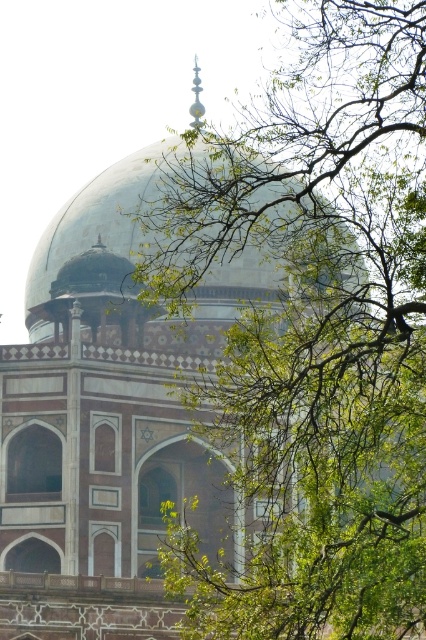
You are an architect designing a new garden around the green glass dome at center. You want to ensure that the green leafy branches at upper center do not block the view of the dome from the garden path. Based on the current sizes of these elements, is this feasible?

The green leafy branches at upper center are bigger than the green glass dome at center. This means they could potentially block the dome from view if not managed. To ensure visibility, the branches would need to be pruned or positioned so their size doesn

You are standing in front of a historic Mughal building with a large dome. You notice a point marked at coordinates (314, 330). Based on the scene, what is the location of this point relative to the building and its surroundings?

The point at (314, 330) is located on green leafy branches at the upper center, which partially obscure the large dome of the building.

You are an architect examining the structure of the building. You notice the green leafy branches at upper center and the green glass dome at center. Which object is positioned lower in the image?

The green leafy branches at upper center is below the green glass dome at center, so the branches are positioned lower than the dome.